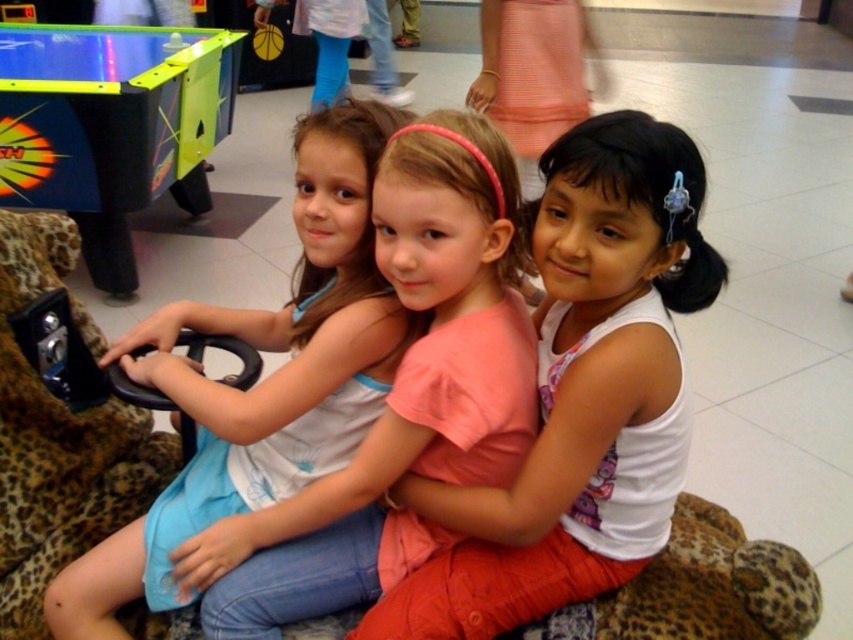
Question: Is pink cotton shirt at center below pink fabric dress at center?

Choices:
 (A) no
 (B) yes

Answer: (B)

Question: Can you confirm if pink cotton shirt at center is wider than pink fabric dress at center?

Choices:
 (A) yes
 (B) no

Answer: (B)

Question: Does pink cotton shirt at center appear under pink fabric dress at center?

Choices:
 (A) yes
 (B) no

Answer: (A)

Question: Which object is closer to the camera taking this photo?

Choices:
 (A) pink fabric dress at center
 (B) pink cotton shirt at center

Answer: (B)